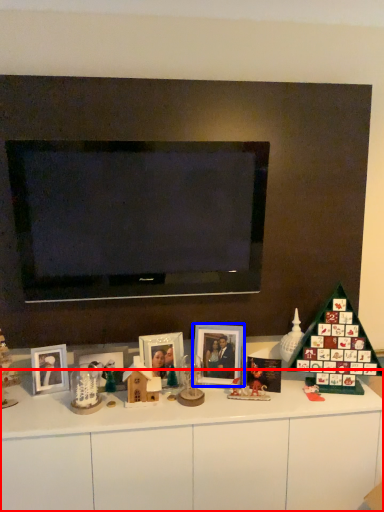
Question: Which point is further to the camera, dresser (highlighted by a red box) or picture frame (highlighted by a blue box)?

Choices:
 (A) dresser
 (B) picture frame

Answer: (B)